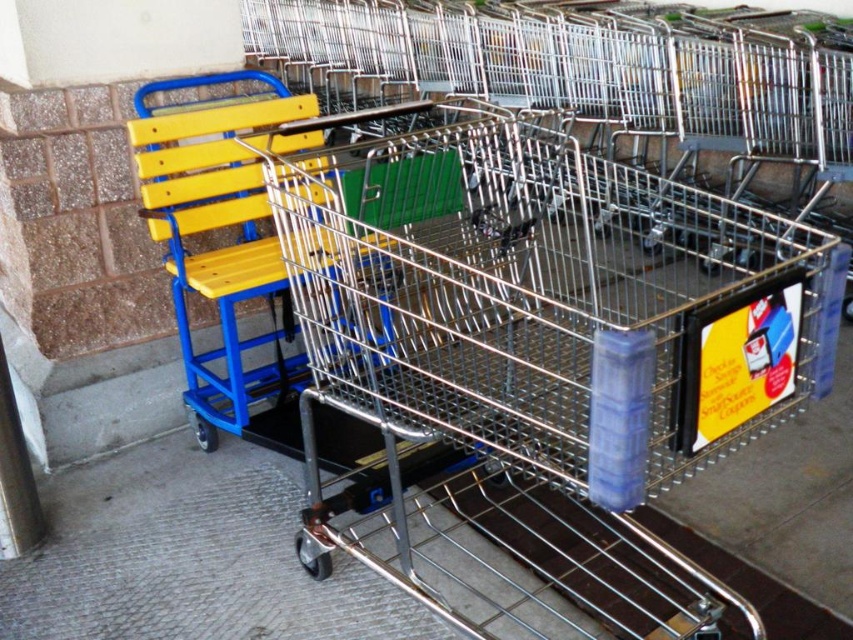
Does metallic silver shopping cart at center have a smaller size compared to yellow wood chair at center?

Actually, metallic silver shopping cart at center might be larger than yellow wood chair at center.

Is metallic silver shopping cart at center to the right of yellow wood chair at center from the viewer's perspective?

Yes, metallic silver shopping cart at center is to the right of yellow wood chair at center.

The image size is (853, 640). I want to click on metallic silver shopping cart at center, so click(532, 364).